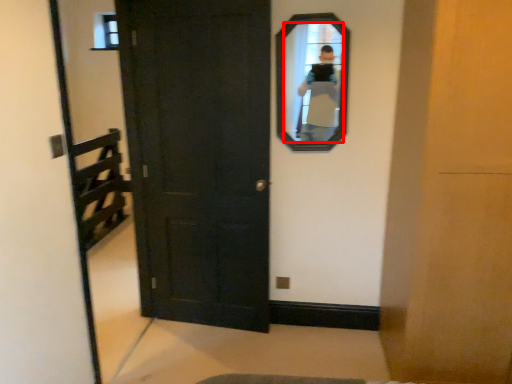
Question: Observing the image, what is the correct spatial positioning of mirror (annotated by the red box) in reference to door?

Choices:
 (A) right
 (B) left

Answer: (A)